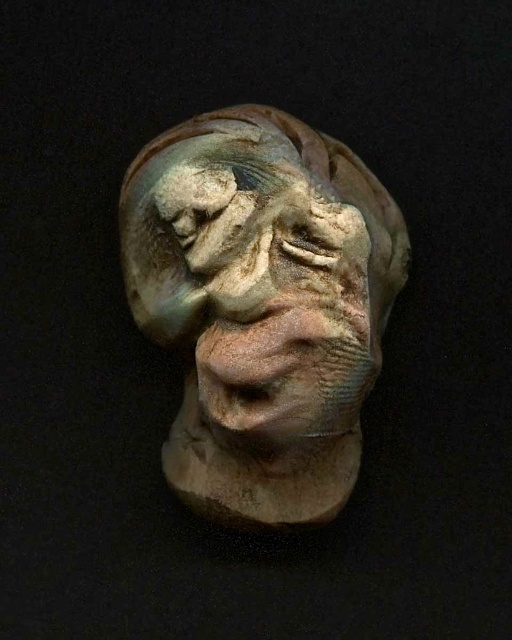
You are an art conservator assessing the stability of the sculpture. You notice two distinct sections labeled as the matte clay sculpture at center and the earthy clay sculpture at center. Given that the distance between them is critical for structural integrity, would the 1.71 centimeter gap pose a potential risk of separation during transportation?

The distance between the matte clay sculpture at center and the earthy clay sculpture at center is 1.71 centimeters. This gap may pose a risk of separation during transportation as the sections are not securely connected. Proper stabilization measures should be taken to prevent movement between them.

You are an art student who wants to place a small statue on a shelf. You have two options, the matte clay sculpture at center and the earthy clay sculpture at center. Which sculpture should you choose if you want the one that is taller?

The matte clay sculpture at center is much taller as earthy clay sculpture at center, so you should choose the matte clay sculpture at center.

You are an art restorer standing 3.5 feet away from the matte clay sculpture at center. Can you reach it without moving closer?

The matte clay sculpture at center is 4.11 feet away from the viewer. Since you are 3.5 feet away, you are closer than the required distance, so you can reach it without moving closer.